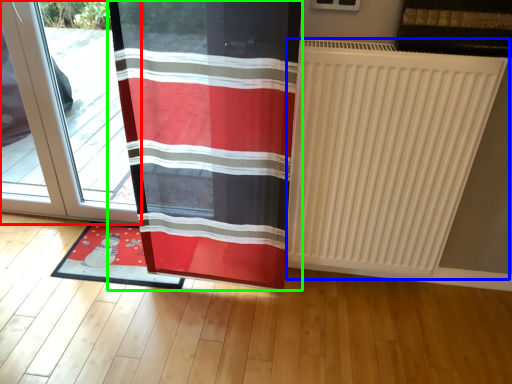
Question: Which object is the farthest from door (highlighted by a red box)? Choose among these: radiator (highlighted by a blue box) or curtain (highlighted by a green box).

Choices:
 (A) radiator
 (B) curtain

Answer: (A)